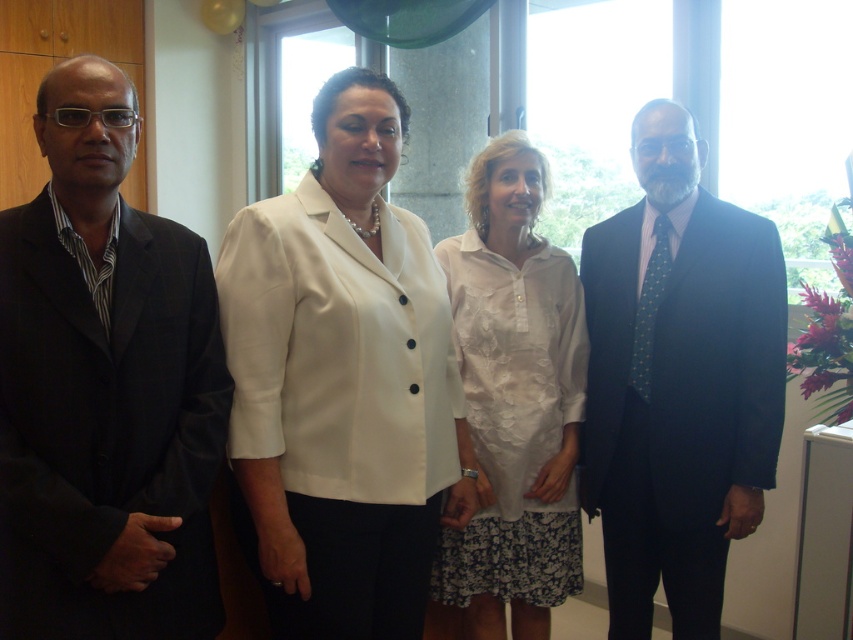
You are a photographer setting up for a group photo. You need to ensure that the white matte blazer at center and the dark blue suit at right are both visible in the frame. Based on their heights, which one might require you to adjust the camera angle upwards to capture the full length?

The dark blue suit at right is taller than the white matte blazer at center, so you would need to adjust the camera angle upwards to capture the full length of the dark blue suit at right.

You are organizing a photo shoot and need to arrange two key outfits from left to right. The matte black suit at left and the white matte blazer at center are both important. Based on their current positions in the image, which outfit should be placed first from the left side?

The matte black suit at left should be placed first from the left side since it is already positioned on the left side of the white matte blazer at center in the image.

You are organizing a photo shoot and need to adjust the positioning of the matte black suit at left and the dark blue suit at right. According to the scene description, which suit is currently placed in front of the other?

The matte black suit at left is positioned over dark blue suit at right, meaning it is in front of the dark blue suit at right.